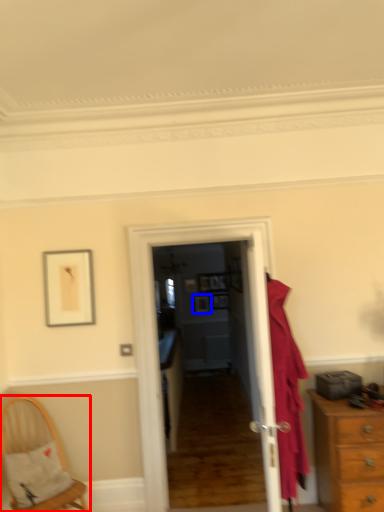
Question: Among these objects, which one is nearest to the camera, chair (highlighted by a red box) or picture frame (highlighted by a blue box)?

Choices:
 (A) chair
 (B) picture frame

Answer: (A)